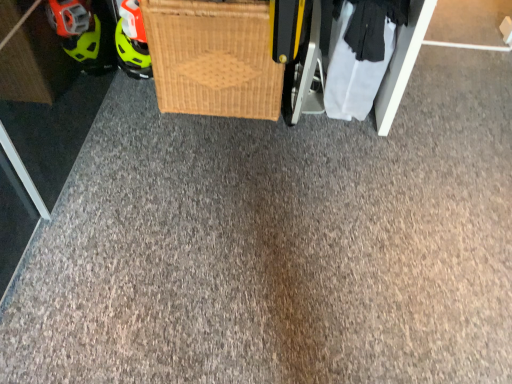
What do you see at coordinates (361, 54) in the screenshot? The image size is (512, 384). I see `white fabric at lower right` at bounding box center [361, 54].

Measure the distance between white fabric at lower right and camera.

white fabric at lower right is 5.02 feet away from camera.

Locate an element on the screen. white fabric at lower right is located at coordinates (361, 54).

Measure the distance between point (175, 6) and camera.

5.04 feet.

Where is `woven wood basket at center`? This screenshot has height=384, width=512. woven wood basket at center is located at coordinates (213, 58).

In order to face woven wood basket at center, should I rotate leftwards or rightwards?

Rotate left and turn 4.445 degrees.

Image resolution: width=512 pixels, height=384 pixels. What do you see at coordinates (213, 58) in the screenshot?
I see `woven wood basket at center` at bounding box center [213, 58].

The height and width of the screenshot is (384, 512). What are the coordinates of `white fabric at lower right` in the screenshot? It's located at (361, 54).

Based on their positions, is woven wood basket at center located to the left or right of white fabric at lower right?

In the image, woven wood basket at center appears on the left side of white fabric at lower right.

Which is in front, woven wood basket at center or white fabric at lower right?

woven wood basket at center is closer to the camera.

Is point (247, 110) closer or farther from the camera than point (392, 7)?

Point (247, 110) is farther from the camera than point (392, 7).

From the image's perspective, would you say woven wood basket at center is shown under white fabric at lower right?

Actually, woven wood basket at center appears above white fabric at lower right in the image.

From a real-world perspective, is woven wood basket at center above or below white fabric at lower right?

woven wood basket at center is situated higher than white fabric at lower right in the real world.

Is woven wood basket at center wider than white fabric at lower right?

Indeed, woven wood basket at center has a greater width compared to white fabric at lower right.

Considering the relative sizes of woven wood basket at center and white fabric at lower right in the image provided, is woven wood basket at center shorter than white fabric at lower right?

In fact, woven wood basket at center may be taller than white fabric at lower right.

In the scene shown: Between woven wood basket at center and white fabric at lower right, which one has larger size?

Bigger between the two is woven wood basket at center.

Is woven wood basket at center not inside white fabric at lower right?

Yes, woven wood basket at center is located beyond the bounds of white fabric at lower right.

Is there a large distance between woven wood basket at center and white fabric at lower right?

Actually, woven wood basket at center and white fabric at lower right are a little close together.

Is woven wood basket at center oriented towards white fabric at lower right?

No, woven wood basket at center is not oriented towards white fabric at lower right.

Looking at this image, can you tell me how much woven wood basket at center and white fabric at lower right differ in facing direction?

0.933 degrees.

Locate an element on the screen. This screenshot has height=384, width=512. clothing located behind the woven wood basket at center is located at coordinates (361, 54).

Can you confirm if white fabric at lower right is positioned to the left of woven wood basket at center?

Incorrect, white fabric at lower right is not on the left side of woven wood basket at center.

Is the position of white fabric at lower right more distant than that of woven wood basket at center?

Yes, white fabric at lower right is further from the viewer.

Is point (350, 52) behind point (233, 99)?

No, (350, 52) is in front of (233, 99).

From the image's perspective, is white fabric at lower right positioned above or below woven wood basket at center?

From the image's perspective, white fabric at lower right appears below woven wood basket at center.

From a real-world perspective, which object stands above the other?

woven wood basket at center, from a real-world perspective.

Looking at this image, between white fabric at lower right and woven wood basket at center, which one has smaller width?

white fabric at lower right.

Is white fabric at lower right shorter than woven wood basket at center?

Yes.

Which of these two, white fabric at lower right or woven wood basket at center, is bigger?

woven wood basket at center.

Is white fabric at lower right outside of woven wood basket at center?

That's correct, white fabric at lower right is outside of woven wood basket at center.

Would you consider white fabric at lower right to be distant from woven wood basket at center?

Actually, white fabric at lower right and woven wood basket at center are a little close together.

Is woven wood basket at center at the back of white fabric at lower right?

white fabric at lower right does not have its back to woven wood basket at center.

Can you tell me how much white fabric at lower right and woven wood basket at center differ in facing direction?

The angular difference between white fabric at lower right and woven wood basket at center is 0.933 degrees.

How far apart are white fabric at lower right and woven wood basket at center?

white fabric at lower right is 16.45 inches away from woven wood basket at center.

Where is `clothing behind the woven wood basket at center`? The width and height of the screenshot is (512, 384). clothing behind the woven wood basket at center is located at coordinates (361, 54).

In order to click on clothing below the woven wood basket at center (from a real-world perspective) in this screenshot , I will do `click(361, 54)`.

The image size is (512, 384). In the image, there is a white fabric at lower right. What are the coordinates of `basket above it (from the image's perspective)` in the screenshot? It's located at (213, 58).